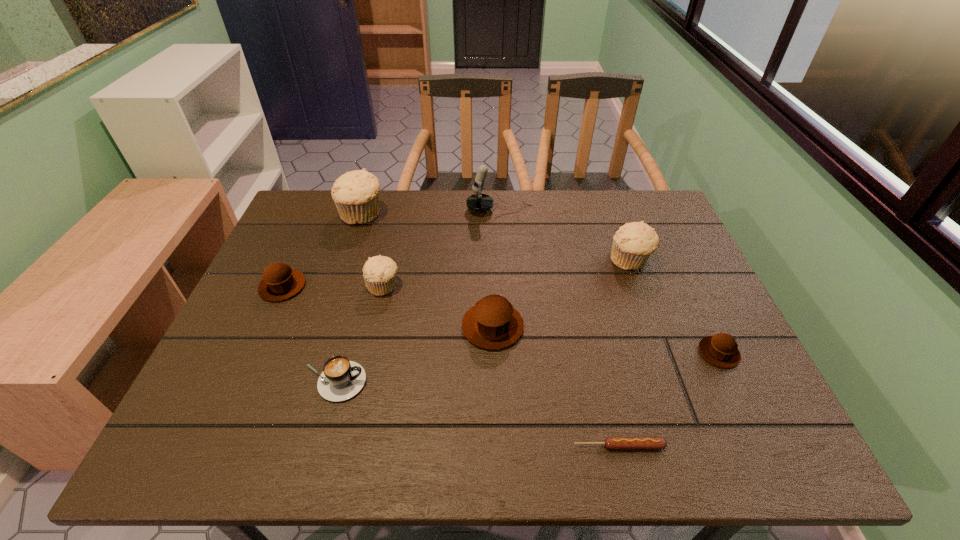
The height and width of the screenshot is (540, 960). Identify the location of vacant space at the near edge of the desktop. (502, 450).

Identify the location of free location at the left edge. (290, 314).

Image resolution: width=960 pixels, height=540 pixels. Find the location of `vacant area at the right edge`. vacant area at the right edge is located at coordinates (686, 293).

This screenshot has width=960, height=540. Find the location of `vacant space at the far left corner`. vacant space at the far left corner is located at coordinates (295, 231).

You are a GUI agent. You are given a task and a screenshot of the screen. Output one action in this format:
    pyautogui.click(x=<x>, y=<y>)
    Task: Click on the vacant space at the near left corner of the desktop
    Image resolution: width=960 pixels, height=540 pixels.
    Given the screenshot: What is the action you would take?
    (x=189, y=450)

Find the location of `vacant space in between the microphone and the black cappuccino`. vacant space in between the microphone and the black cappuccino is located at coordinates (417, 296).

Locate an element on the screen. Image resolution: width=960 pixels, height=540 pixels. unoccupied position between the sausage and the white microphone is located at coordinates (559, 328).

The width and height of the screenshot is (960, 540). Find the location of `vacant area between the white microphone and the second tallest muffin`. vacant area between the white microphone and the second tallest muffin is located at coordinates (564, 235).

The image size is (960, 540). What are the coordinates of `free point between the white microphone and the cappuccino` in the screenshot? It's located at 417,296.

You are a GUI agent. You are given a task and a screenshot of the screen. Output one action in this format:
    pyautogui.click(x=<x>, y=<y>)
    Task: Click on the free area in between the third muffin from right to left and the third muffin from left to right
    The image size is (960, 540).
    Given the screenshot: What is the action you would take?
    pyautogui.click(x=438, y=306)